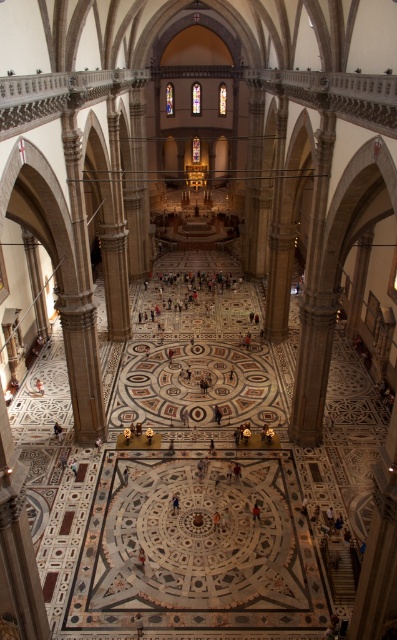
Question: Does red fabric person at center appear over dark blue fabric at center?

Choices:
 (A) yes
 (B) no

Answer: (B)

Question: Does red fabric person at center have a lesser width compared to light brown wooden chair at center?

Choices:
 (A) no
 (B) yes

Answer: (B)

Question: Which point is farther from the camera taking this photo?

Choices:
 (A) (254, 515)
 (B) (73, 468)
 (C) (177, 497)

Answer: (B)

Question: Is dark blue fabric at center above light brown wooden chair at center?

Choices:
 (A) yes
 (B) no

Answer: (B)

Question: Estimate the real-world distances between objects in this image. Which object is farther from the red fabric person at center?

Choices:
 (A) light brown wooden chair at center
 (B) dark blue fabric at center

Answer: (A)

Question: Which point is closer to the camera taking this photo?

Choices:
 (A) (173, 500)
 (B) (77, 467)

Answer: (A)